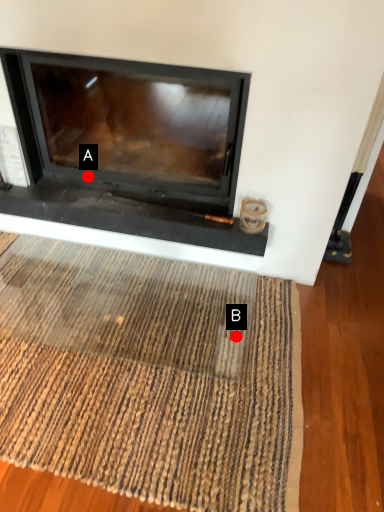
Question: Two points are circled on the image, labeled by A and B beside each circle. Which point is further to the camera?

Choices:
 (A) A is further
 (B) B is further

Answer: (A)